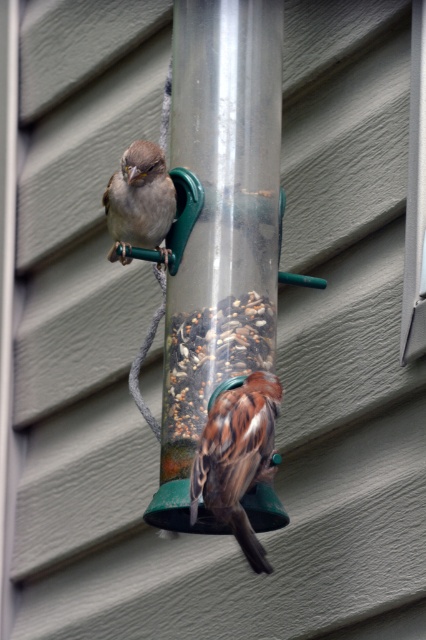
Can you confirm if brown speckled feathers at center is shorter than matte brown sparrow at upper left?

In fact, brown speckled feathers at center may be taller than matte brown sparrow at upper left.

Does brown speckled feathers at center have a lesser width compared to matte brown sparrow at upper left?

No.

Where is `brown speckled feathers at center`? This screenshot has height=640, width=426. brown speckled feathers at center is located at coordinates (236, 458).